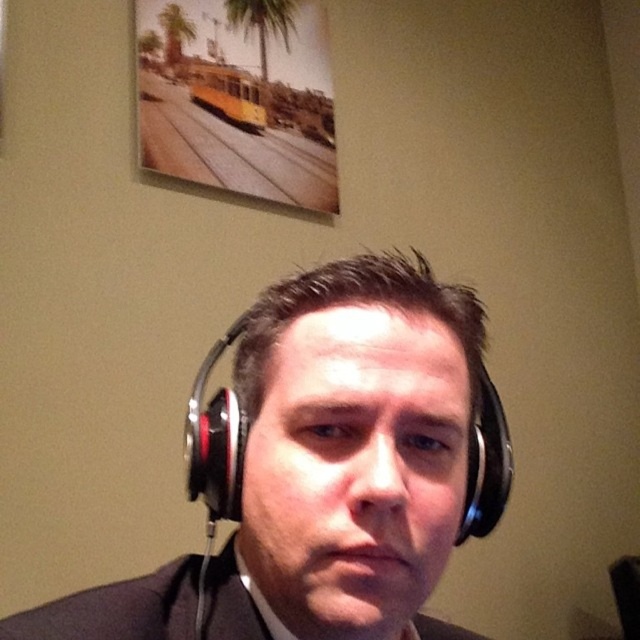
From the picture: You are an interior designer assessing the placement of furniture in a room. You notice a point labeled as point (116, 609) in the image. Based on the scene description provided, what does this point correspond to?

The point (116, 609) corresponds to the black matte business suit at lower center.

You are a tailor who needs to determine if the black matte business suit at lower center can accommodate the black matte headphones at center in a standard garment bag without folding either item. Based on their sizes, is this possible?

The black matte business suit at lower center might be wider than black matte headphones at center, so there is a possibility that the suit requires more space. To ensure both items fit without folding, the garment bag should be large enough to accommodate the wider item, which is likely the suit.